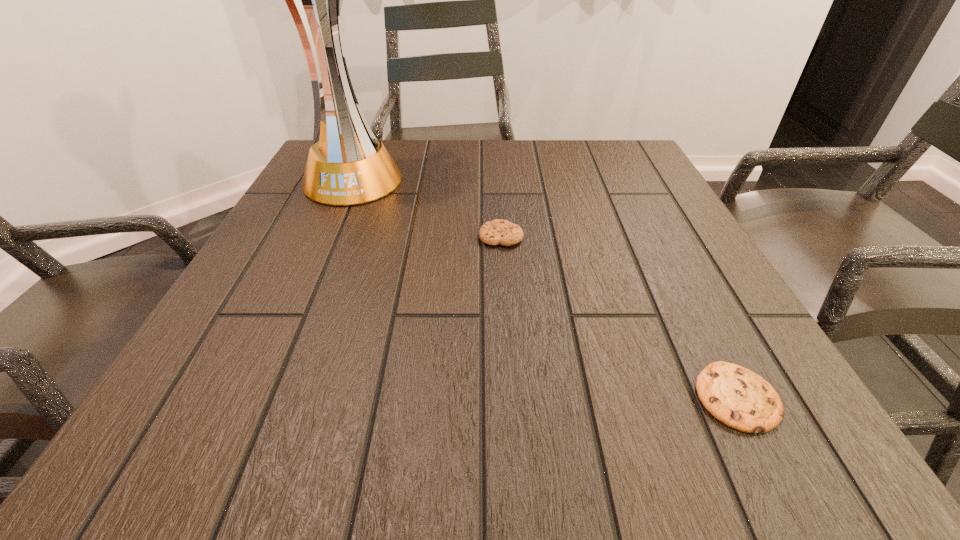
The image size is (960, 540). Identify the location of object that can be found as the second closest to the leftmost object. (734, 395).

Identify which object is the nearest to the second tallest object. Please provide its 2D coordinates. Your answer should be formatted as a tuple, i.e. [(x, y)], where the tuple contains the x and y coordinates of a point satisfying the conditions above.

[(353, 168)]

Identify the location of free spot that satisfies the following two spatial constraints: 1. on the front-facing side of the second nearest object; 2. on the left side of the tallest object. This screenshot has width=960, height=540. (326, 237).

Find the location of a particular element. This screenshot has width=960, height=540. free space that satisfies the following two spatial constraints: 1. on the front-facing side of the second object from left to right; 2. on the left side of the trophy is located at coordinates (326, 237).

At what (x,y) coordinates should I click in order to perform the action: click on free space that satisfies the following two spatial constraints: 1. on the front-facing side of the nearer cookie; 2. on the right side of the farthest object. Please return your answer as a coordinate pair (x, y). Looking at the image, I should click on (254, 397).

At what (x,y) coordinates should I click in order to perform the action: click on free region that satisfies the following two spatial constraints: 1. on the front-facing side of the shorter cookie; 2. on the left side of the tallest object. Please return your answer as a coordinate pair (x, y). Image resolution: width=960 pixels, height=540 pixels. Looking at the image, I should click on (254, 397).

At what (x,y) coordinates should I click in order to perform the action: click on free space that satisfies the following two spatial constraints: 1. on the front side of the left cookie; 2. on the left side of the nearest object. Please return your answer as a coordinate pair (x, y). Looking at the image, I should click on (511, 397).

Find the location of a particular element. vacant area in the image that satisfies the following two spatial constraints: 1. on the front side of the shorter cookie; 2. on the right side of the second object from right to left is located at coordinates (511, 397).

Find the location of `free space that satisfies the following two spatial constraints: 1. on the front-facing side of the leftmost object; 2. on the left side of the right cookie`. free space that satisfies the following two spatial constraints: 1. on the front-facing side of the leftmost object; 2. on the left side of the right cookie is located at coordinates (254, 397).

Identify the location of vacant position in the image that satisfies the following two spatial constraints: 1. on the front-facing side of the leftmost object; 2. on the left side of the left cookie. (326, 237).